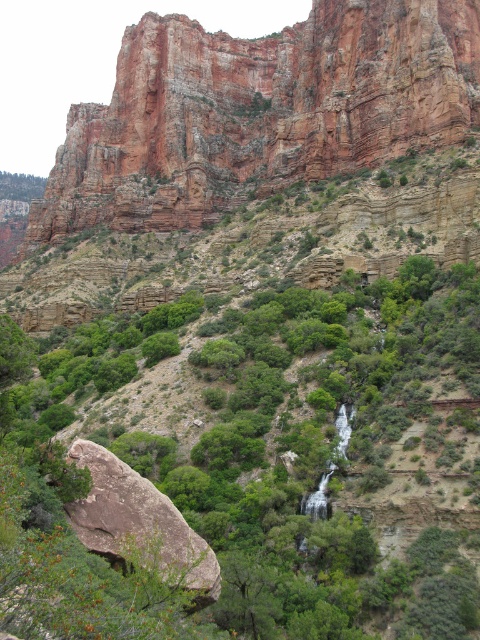
In the scene shown: Who is more distant from viewer, (327, 99) or (73, 449)?

The point (327, 99) is more distant.

Does rustic rock cliff at upper center come in front of brown rough rock at lower left?

No, rustic rock cliff at upper center is further to the viewer.

Describe the element at coordinates (259, 112) in the screenshot. The height and width of the screenshot is (640, 480). I see `rustic rock cliff at upper center` at that location.

Image resolution: width=480 pixels, height=640 pixels. What are the coordinates of `rustic rock cliff at upper center` in the screenshot? It's located at (259, 112).

Who is higher up, green leafy tree at center or brown rough rock at lower left?

green leafy tree at center is higher up.

Does green leafy tree at center appear over brown rough rock at lower left?

Yes.

Find the location of a particular element. This screenshot has height=640, width=480. green leafy tree at center is located at coordinates (305, 445).

Is green leafy tree at center above rustic rock cliff at upper center?

Incorrect, green leafy tree at center is not positioned above rustic rock cliff at upper center.

Is point (86, 419) positioned in front of point (418, 122)?

That is True.

In order to click on green leafy tree at center in this screenshot , I will do `click(305, 445)`.